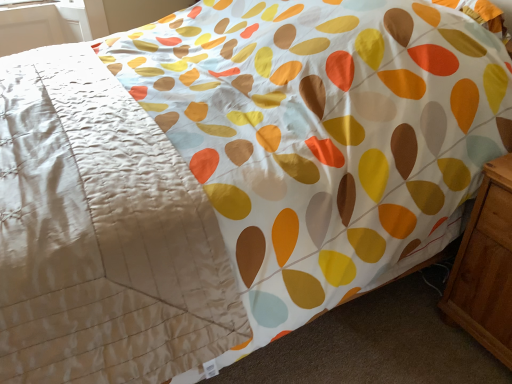
Question: Could silky beige blanket at upper left be considered to be inside light brown wood at right?

Choices:
 (A) no
 (B) yes

Answer: (A)

Question: Is light brown wood at right at the right side of silky beige blanket at upper left?

Choices:
 (A) no
 (B) yes

Answer: (B)

Question: Is light brown wood at right turned away from silky beige blanket at upper left?

Choices:
 (A) yes
 (B) no

Answer: (B)

Question: From the image's perspective, would you say light brown wood at right is positioned over silky beige blanket at upper left?

Choices:
 (A) no
 (B) yes

Answer: (A)

Question: Considering the relative sizes of light brown wood at right and silky beige blanket at upper left in the image provided, is light brown wood at right smaller than silky beige blanket at upper left?

Choices:
 (A) no
 (B) yes

Answer: (B)

Question: Is light brown wood at right directly adjacent to silky beige blanket at upper left?

Choices:
 (A) no
 (B) yes

Answer: (A)

Question: From the image's perspective, would you say silky beige blanket at upper left is positioned over light brown wood at right?

Choices:
 (A) yes
 (B) no

Answer: (A)

Question: Can you confirm if silky beige blanket at upper left is shorter than light brown wood at right?

Choices:
 (A) yes
 (B) no

Answer: (A)

Question: From the image's perspective, would you say silky beige blanket at upper left is shown under light brown wood at right?

Choices:
 (A) no
 (B) yes

Answer: (A)

Question: Is silky beige blanket at upper left positioned far away from light brown wood at right?

Choices:
 (A) no
 (B) yes

Answer: (A)

Question: Is silky beige blanket at upper left outside light brown wood at right?

Choices:
 (A) no
 (B) yes

Answer: (B)

Question: Is light brown wood at right at the back of silky beige blanket at upper left?

Choices:
 (A) yes
 (B) no

Answer: (A)

Question: Considering the positions of light brown wood at right and silky beige blanket at upper left in the image, is light brown wood at right taller or shorter than silky beige blanket at upper left?

Choices:
 (A) short
 (B) tall

Answer: (B)